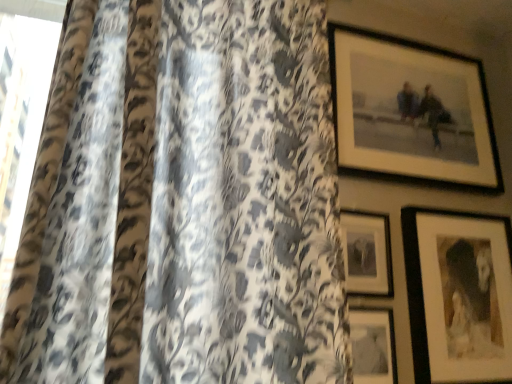
Question: Looking at the image, does matte black picture frame at lower center, the 1th picture frame when ordered from bottom to top, seem bigger or smaller compared to matte black picture frame at center, placed as the 2th picture frame when sorted from top to bottom?

Choices:
 (A) big
 (B) small

Answer: (B)

Question: Is point (377, 332) positioned closer to the camera than point (364, 286)?

Choices:
 (A) closer
 (B) farther

Answer: (A)

Question: Considering the real-world distances, which object is farthest from the matte black picture frame at center, placed as the 2th picture frame when sorted from top to bottom?

Choices:
 (A) matte black picture frame at lower right, arranged as the 3th picture frame when viewed from the top
 (B) leopard print fabric at left
 (C) matte black picture frame at lower center, the 1th picture frame when ordered from bottom to top
 (D) matte black picture frame at upper right, marked as the 4th picture frame in a bottom-to-top arrangement

Answer: (B)

Question: Estimate the real-world distances between objects in this image. Which object is closer to the matte black picture frame at lower center, the 1th picture frame when ordered from bottom to top?

Choices:
 (A) leopard print fabric at left
 (B) matte black picture frame at lower right, arranged as the 3th picture frame when viewed from the top
 (C) matte black picture frame at center, positioned as the third picture frame in bottom-to-top order
 (D) matte black picture frame at upper right, marked as the 4th picture frame in a bottom-to-top arrangement

Answer: (C)